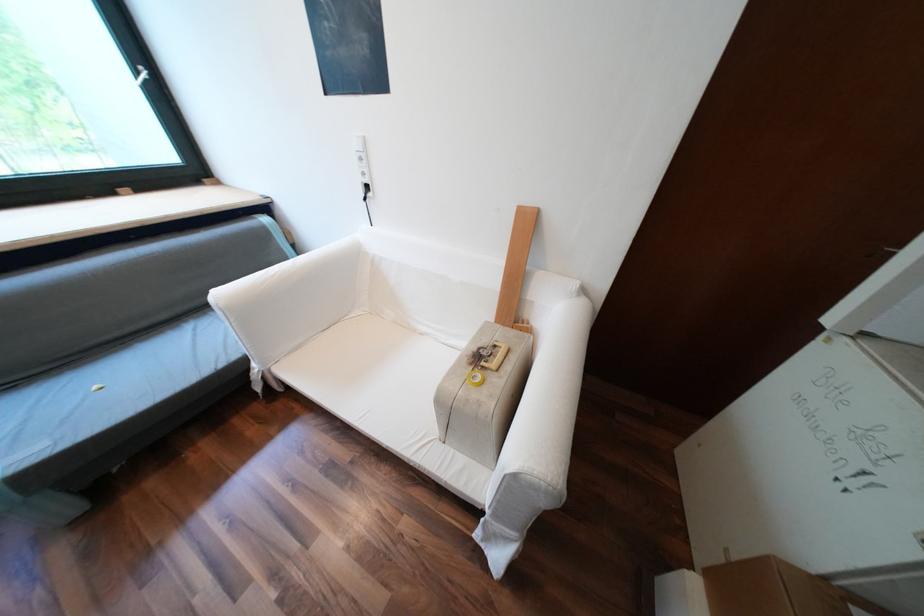
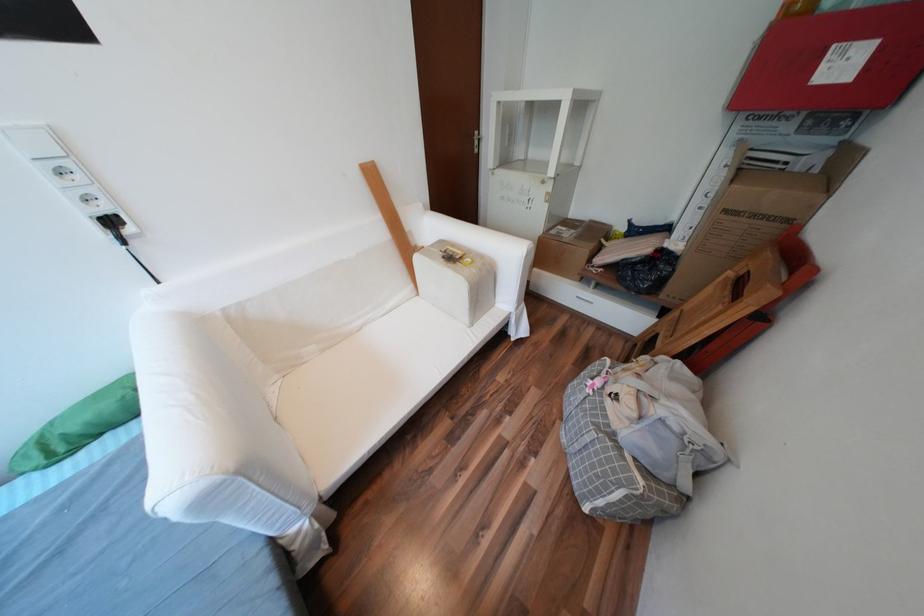
The point at (379, 193) is marked in the first image. Where is the corresponding point in the second image?

(138, 231)